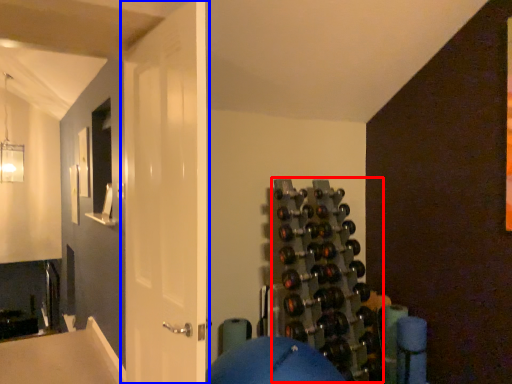
Question: Among these objects, which one is farthest to the camera, wine rack (highlighted by a red box) or door (highlighted by a blue box)?

Choices:
 (A) wine rack
 (B) door

Answer: (A)